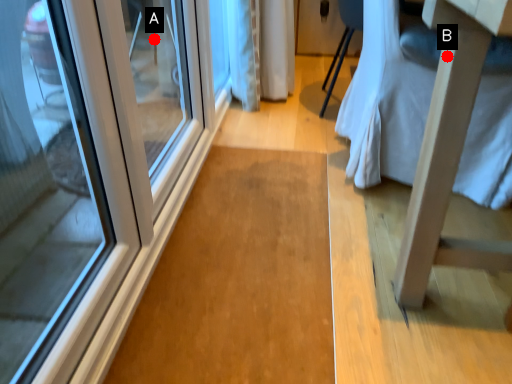
Question: Two points are circled on the image, labeled by A and B beside each circle. Which point is closer to the camera taking this photo?

Choices:
 (A) A is closer
 (B) B is closer

Answer: (B)